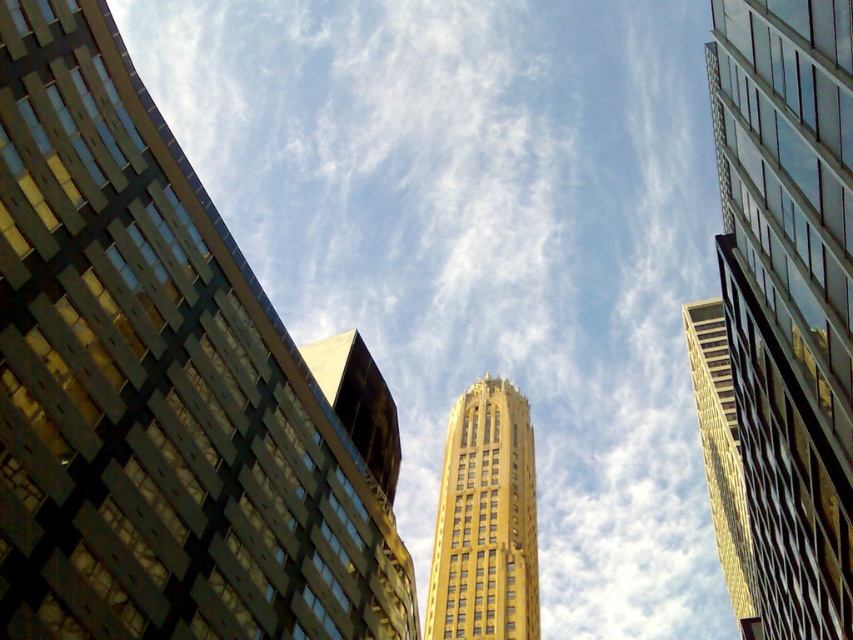
Question: Which object is closer to the camera taking this photo?

Choices:
 (A) gold glass skyscraper at center
 (B) gold glass skyscraper at upper center
 (C) gold glass skyscraper at right
 (D) gold glass tower at center

Answer: (B)

Question: Which point is closer to the camera?

Choices:
 (A) (773, 48)
 (B) (68, 550)
 (C) (363, 429)
 (D) (730, 550)

Answer: (B)

Question: Which point is closer to the camera?

Choices:
 (A) (161, 147)
 (B) (709, 413)

Answer: (A)

Question: Is gold glass tower at center positioned behind gold glass skyscraper at right?

Choices:
 (A) yes
 (B) no

Answer: (A)

Question: Can you confirm if golden glass skyscraper at center is bigger than gold glass skyscraper at center?

Choices:
 (A) yes
 (B) no

Answer: (A)

Question: Is gold glass tower at center further to the viewer compared to gold glass skyscraper at center?

Choices:
 (A) no
 (B) yes

Answer: (B)